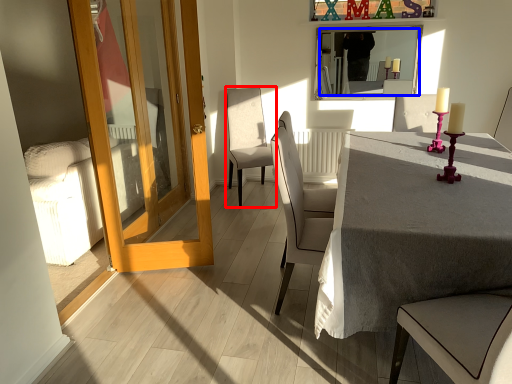
Question: Which object appears closest to the camera in this image, chair (highlighted by a red box) or mirror (highlighted by a blue box)?

Choices:
 (A) chair
 (B) mirror

Answer: (A)